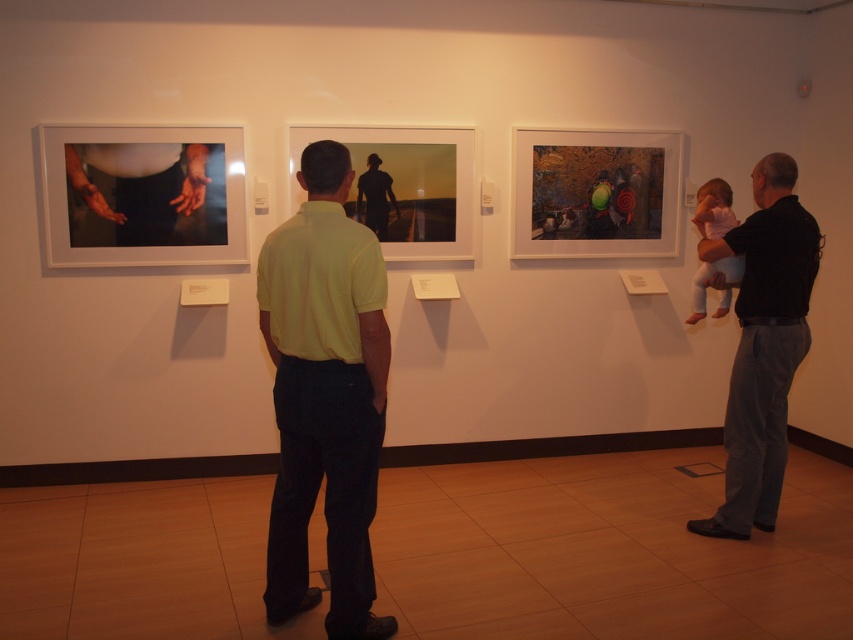
Question: Which point is farther to the camera?

Choices:
 (A) silhouette figure at center
 (B) pink fabric baby at right
 (C) black cotton shirt at right

Answer: (A)

Question: Is light green polo shirt at center behind black cotton shirt at right?

Choices:
 (A) yes
 (B) no

Answer: (B)

Question: Which of these objects is positioned farthest from the pink fabric baby at right?

Choices:
 (A) light green polo shirt at center
 (B) black cotton shirt at right
 (C) silhouette figure at center

Answer: (A)

Question: Considering the relative positions of black cotton shirt at right and silhouette figure at center in the image provided, where is black cotton shirt at right located with respect to silhouette figure at center?

Choices:
 (A) left
 (B) right

Answer: (B)

Question: Based on their relative distances, which object is farther from the black cotton shirt at right?

Choices:
 (A) pink fabric baby at right
 (B) silhouette figure at center

Answer: (B)

Question: Where is light green polo shirt at center located in relation to pink fabric baby at right in the image?

Choices:
 (A) above
 (B) below

Answer: (B)